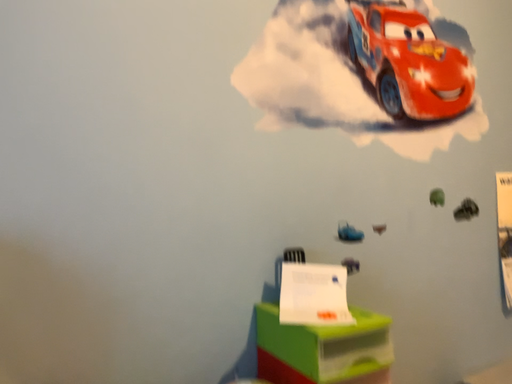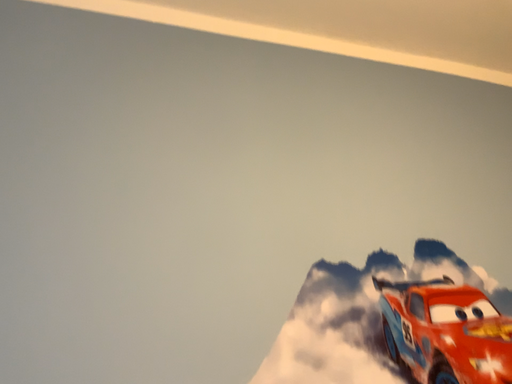
Question: Which way did the camera rotate in the video?

Choices:
 (A) rotated downward
 (B) rotated upward

Answer: (B)